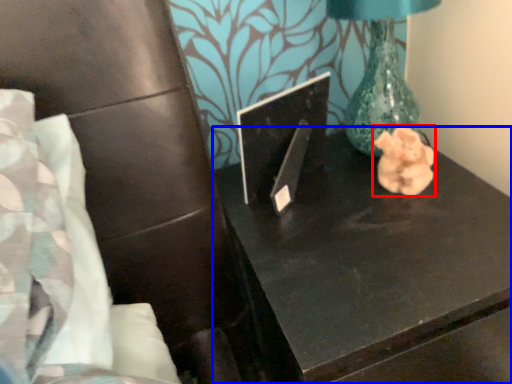
Question: Which object is closer to the camera taking this photo, animal (highlighted by a red box) or table (highlighted by a blue box)?

Choices:
 (A) animal
 (B) table

Answer: (B)